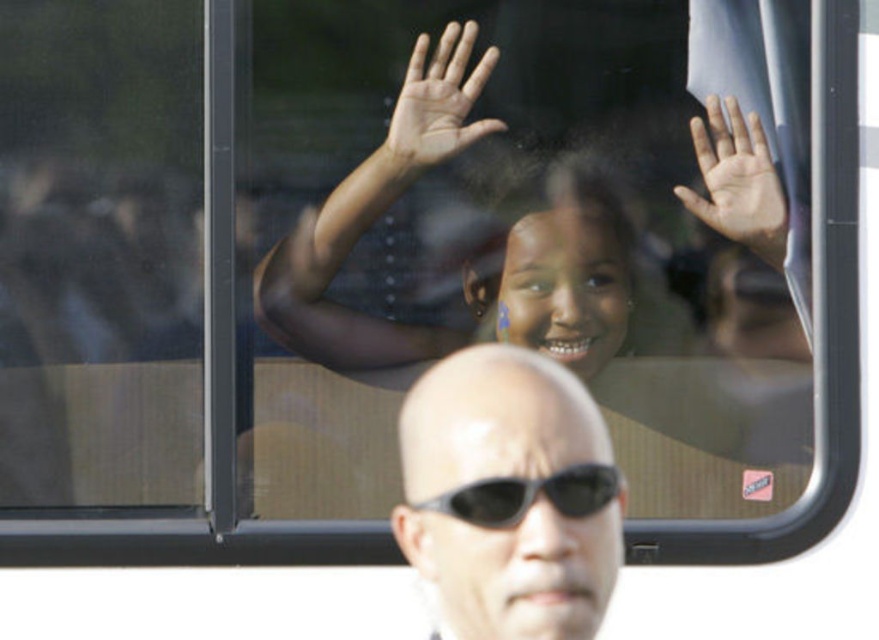
Consider the image. Who is positioned more to the right, bald head at center or light skin hand at upper center?

light skin hand at upper center

Locate an element on the screen. The image size is (879, 640). bald head at center is located at coordinates (509, 497).

Which is behind, point (474, 577) or point (716, 128)?

The point (716, 128) is more distant.

I want to click on bald head at center, so click(x=509, y=497).

Can you confirm if matte black girl at center is positioned above light skin hand at upper center?

No, matte black girl at center is not above light skin hand at upper center.

Does matte black girl at center lie behind light skin hand at upper center?

No, it is not.

Does point (714, 113) come in front of point (694, 147)?

Yes, point (714, 113) is closer to viewer.

Identify the location of matte black girl at center. The image size is (879, 640). (522, 323).

Who is higher up, bald head at center or light brown skin at upper center?

light brown skin at upper center is higher up.

Locate an element on the screen. bald head at center is located at coordinates (509, 497).

At what (x,y) coordinates should I click in order to perform the action: click on bald head at center. Please return your answer as a coordinate pair (x, y). Looking at the image, I should click on (509, 497).

At what (x,y) coordinates should I click in order to perform the action: click on bald head at center. Please return your answer as a coordinate pair (x, y). The width and height of the screenshot is (879, 640). Looking at the image, I should click on (509, 497).